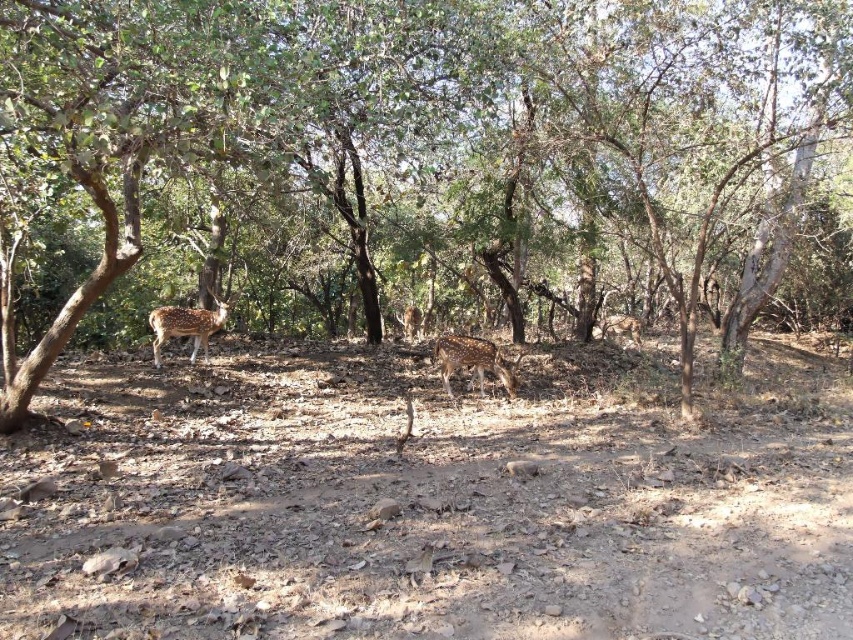
Is brown textured tree at center to the left of brown dirt field at center from the viewer's perspective?

In fact, brown textured tree at center is to the right of brown dirt field at center.

Which of these two, brown textured tree at center or brown dirt field at center, stands shorter?

brown dirt field at center is shorter.

Which is behind, point (619, 157) or point (109, 616)?

The point (619, 157) is more distant.

Find the location of `brown textured tree at center`. brown textured tree at center is located at coordinates (434, 154).

Can you confirm if spotted fur deer at center is positioned below spotted fur deer at left?

Indeed, spotted fur deer at center is positioned under spotted fur deer at left.

Which of these two, spotted fur deer at center or spotted fur deer at left, stands shorter?

Standing shorter between the two is spotted fur deer at center.

Who is more distant from viewer, [439,372] or [201,340]?

The point [439,372] is behind.

The image size is (853, 640). In order to click on spotted fur deer at center in this screenshot , I will do `click(473, 360)`.

Who is higher up, brown dirt field at center or spotted fur deer at center?

spotted fur deer at center

Is brown dirt field at center below spotted fur deer at center?

Correct, brown dirt field at center is located below spotted fur deer at center.

Does point (851, 538) come behind point (505, 368)?

No, it is in front of (505, 368).

Find the location of a particular element. brown dirt field at center is located at coordinates click(x=428, y=499).